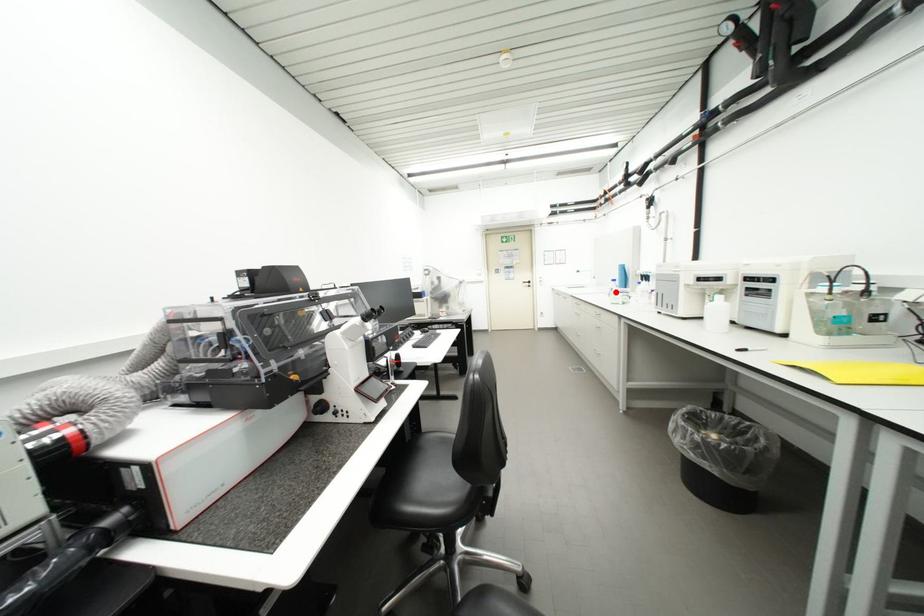
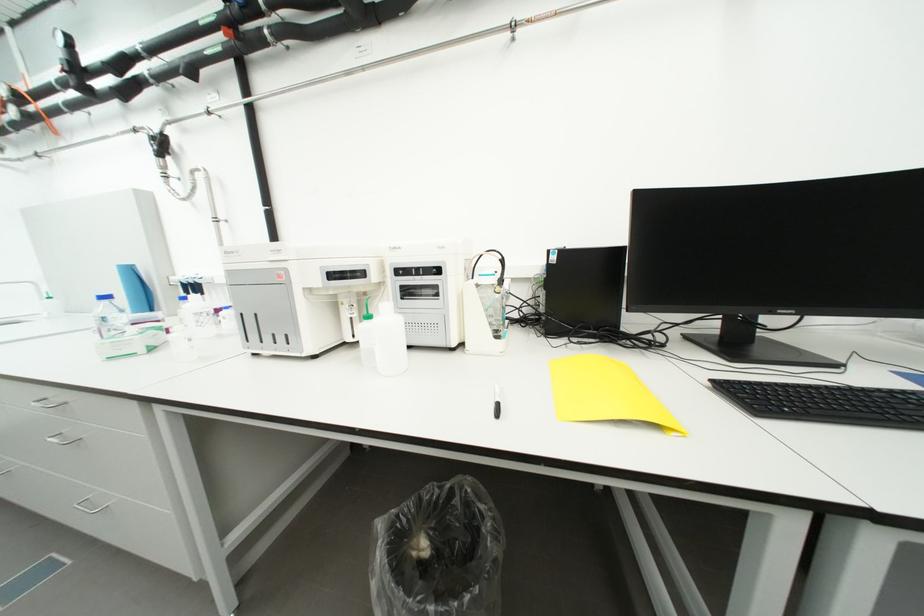
In the second image, find the point that corresponds to the highlighted location in the first image.

(101, 326)